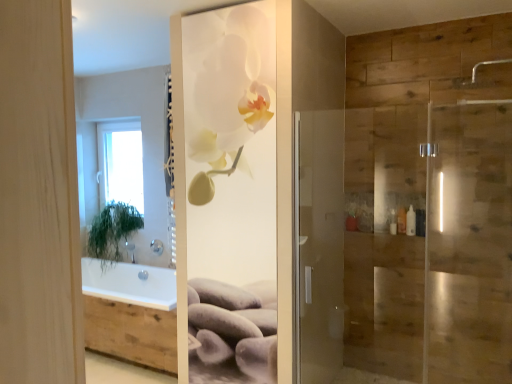
Question: From the image's perspective, is white glossy orchid at center above silver metallic shower head at upper right, which is the 2th shower in left-to-right order?

Choices:
 (A) yes
 (B) no

Answer: (B)

Question: Is white glossy orchid at center taller than silver metallic shower head at upper right, which is the 2th shower in back-to-front order?

Choices:
 (A) yes
 (B) no

Answer: (A)

Question: From the image's perspective, does white glossy orchid at center appear lower than silver metallic shower head at upper right, which is the 2th shower in back-to-front order?

Choices:
 (A) yes
 (B) no

Answer: (A)

Question: Is white glossy orchid at center located outside silver metallic shower head at upper right, placed as the first shower when sorted from right to left?

Choices:
 (A) yes
 (B) no

Answer: (A)

Question: Would you consider white glossy orchid at center to be distant from silver metallic shower head at upper right, placed as the 1th shower when sorted from top to bottom?

Choices:
 (A) yes
 (B) no

Answer: (A)

Question: Is white glossy orchid at center at the left side of silver metallic shower head at upper right, which is the 2th shower in left-to-right order?

Choices:
 (A) no
 (B) yes

Answer: (B)

Question: Does green leafy plant at left have a lesser width compared to satin nickel showerhead at upper center, the second shower in the top-to-bottom sequence?

Choices:
 (A) yes
 (B) no

Answer: (B)

Question: From a real-world perspective, is green leafy plant at left positioned under satin nickel showerhead at upper center, the 1th shower viewed from the back, based on gravity?

Choices:
 (A) no
 (B) yes

Answer: (A)

Question: Does green leafy plant at left have a smaller size compared to satin nickel showerhead at upper center, the 1th shower in the bottom-to-top sequence?

Choices:
 (A) no
 (B) yes

Answer: (A)

Question: Is the surface of green leafy plant at left in direct contact with satin nickel showerhead at upper center, the 1th shower in the bottom-to-top sequence?

Choices:
 (A) no
 (B) yes

Answer: (A)

Question: Considering the relative positions of green leafy plant at left and satin nickel showerhead at upper center, the 2th shower viewed from the right, in the image provided, is green leafy plant at left to the right of satin nickel showerhead at upper center, the 2th shower viewed from the right, from the viewer's perspective?

Choices:
 (A) no
 (B) yes

Answer: (A)

Question: Is green leafy plant at left positioned in front of satin nickel showerhead at upper center, which is the second shower from front to back?

Choices:
 (A) no
 (B) yes

Answer: (B)

Question: Is white glossy orchid at center wider than white plastic bottle at right?

Choices:
 (A) yes
 (B) no

Answer: (B)